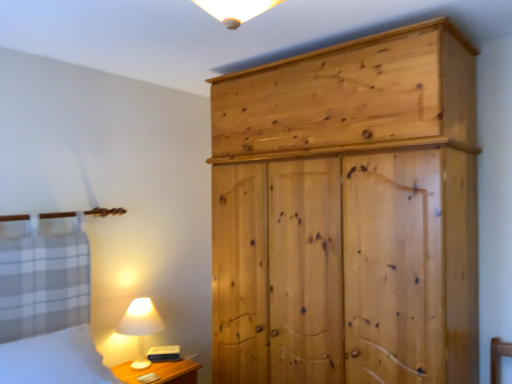
Question: Does white matte table lamp at lower left turn towards white cotton bed at lower left?

Choices:
 (A) no
 (B) yes

Answer: (A)

Question: Is white matte table lamp at lower left touching white cotton bed at lower left?

Choices:
 (A) no
 (B) yes

Answer: (A)

Question: From a real-world perspective, is white matte table lamp at lower left on white cotton bed at lower left?

Choices:
 (A) no
 (B) yes

Answer: (A)

Question: Is white matte table lamp at lower left taller than white cotton bed at lower left?

Choices:
 (A) no
 (B) yes

Answer: (B)

Question: Would you say white matte table lamp at lower left is outside white cotton bed at lower left?

Choices:
 (A) no
 (B) yes

Answer: (B)

Question: Considering the relative sizes of white matte table lamp at lower left and white cotton bed at lower left in the image provided, is white matte table lamp at lower left shorter than white cotton bed at lower left?

Choices:
 (A) no
 (B) yes

Answer: (A)

Question: Can you confirm if natural wood wardrobe at right is bigger than white matte table lamp at lower left?

Choices:
 (A) yes
 (B) no

Answer: (A)

Question: From the image's perspective, is natural wood wardrobe at right below white matte table lamp at lower left?

Choices:
 (A) no
 (B) yes

Answer: (A)

Question: From a real-world perspective, is natural wood wardrobe at right located beneath white matte table lamp at lower left?

Choices:
 (A) yes
 (B) no

Answer: (B)

Question: Does natural wood wardrobe at right have a greater height compared to white matte table lamp at lower left?

Choices:
 (A) no
 (B) yes

Answer: (B)

Question: Is natural wood wardrobe at right at the left side of white matte table lamp at lower left?

Choices:
 (A) yes
 (B) no

Answer: (B)

Question: Is the surface of natural wood wardrobe at right in direct contact with white matte table lamp at lower left?

Choices:
 (A) yes
 (B) no

Answer: (B)

Question: Is natural wood wardrobe at right a part of wooden nightstand at lower left?

Choices:
 (A) no
 (B) yes

Answer: (A)